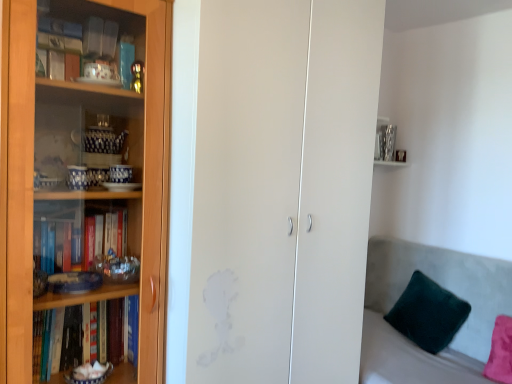
Question: Considering the positions of point (420, 286) and point (76, 225), is point (420, 286) closer or farther from the camera than point (76, 225)?

Choices:
 (A) farther
 (B) closer

Answer: (A)

Question: Choose the correct answer: Is velvety green pillow at lower right inside wooden bookcase at left or outside it?

Choices:
 (A) inside
 (B) outside

Answer: (B)

Question: Estimate the real-world distances between objects in this image. Which object is farther from the velvet grey couch at right?

Choices:
 (A) wooden bookcase at left
 (B) velvety green pillow at lower right
 (C) transparent glass cabinet at left

Answer: (A)

Question: Which of these objects is positioned farthest from the transparent glass cabinet at left?

Choices:
 (A) velvet grey couch at right
 (B) velvety green pillow at lower right
 (C) wooden bookcase at left

Answer: (B)